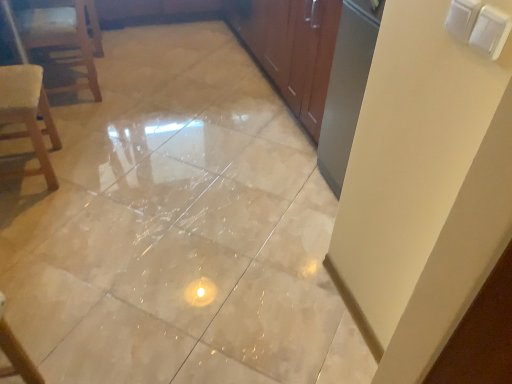
Question: Considering the relative sizes of wooden chair at left and wooden textured chair at left in the image provided, is wooden chair at left bigger than wooden textured chair at left?

Choices:
 (A) no
 (B) yes

Answer: (B)

Question: Is wooden chair at left surrounding wooden textured chair at left?

Choices:
 (A) no
 (B) yes

Answer: (A)

Question: Is wooden chair at left directly adjacent to wooden textured chair at left?

Choices:
 (A) yes
 (B) no

Answer: (B)

Question: From the image's perspective, is wooden chair at left over wooden textured chair at left?

Choices:
 (A) yes
 (B) no

Answer: (A)

Question: Is wooden chair at left to the left of wooden textured chair at left from the viewer's perspective?

Choices:
 (A) no
 (B) yes

Answer: (B)

Question: Considering the relative sizes of wooden chair at left and wooden textured chair at left in the image provided, is wooden chair at left wider than wooden textured chair at left?

Choices:
 (A) no
 (B) yes

Answer: (B)

Question: Is wooden textured chair at left not close to wooden chair at left?

Choices:
 (A) no
 (B) yes

Answer: (A)

Question: Is wooden textured chair at left oriented towards wooden chair at left?

Choices:
 (A) no
 (B) yes

Answer: (A)

Question: Is wooden textured chair at left outside of wooden chair at left?

Choices:
 (A) yes
 (B) no

Answer: (A)

Question: From the image's perspective, would you say wooden textured chair at left is positioned over wooden chair at left?

Choices:
 (A) yes
 (B) no

Answer: (B)

Question: Considering the relative positions of wooden textured chair at left and wooden chair at left in the image provided, is wooden textured chair at left to the left of wooden chair at left from the viewer's perspective?

Choices:
 (A) no
 (B) yes

Answer: (A)

Question: From a real-world perspective, is wooden textured chair at left over wooden chair at left?

Choices:
 (A) no
 (B) yes

Answer: (B)

Question: From a real-world perspective, is wooden chair at left physically above beige glossy tile at center?

Choices:
 (A) yes
 (B) no

Answer: (A)